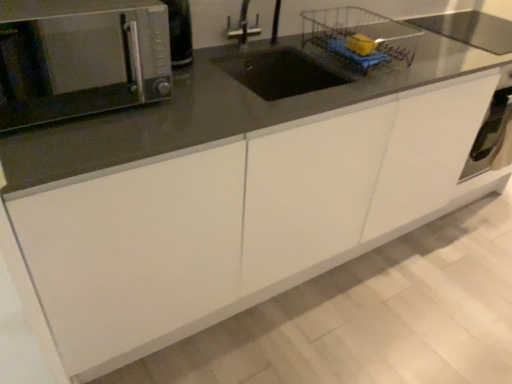
Question: Considering the relative positions of satin silver oven at lower right and satin silver microwave at upper left in the image provided, is satin silver oven at lower right to the right of satin silver microwave at upper left from the viewer's perspective?

Choices:
 (A) yes
 (B) no

Answer: (A)

Question: Can you confirm if satin silver oven at lower right is thinner than satin silver microwave at upper left?

Choices:
 (A) yes
 (B) no

Answer: (A)

Question: Can you confirm if satin silver oven at lower right is positioned to the left of satin silver microwave at upper left?

Choices:
 (A) yes
 (B) no

Answer: (B)

Question: Is the depth of satin silver oven at lower right less than that of satin silver microwave at upper left?

Choices:
 (A) no
 (B) yes

Answer: (A)

Question: Is satin silver oven at lower right facing away from satin silver microwave at upper left?

Choices:
 (A) yes
 (B) no

Answer: (B)

Question: Considering the relative sizes of satin silver oven at lower right and satin silver microwave at upper left in the image provided, is satin silver oven at lower right taller than satin silver microwave at upper left?

Choices:
 (A) yes
 (B) no

Answer: (A)

Question: Considering the relative sizes of wire mesh basket at upper center and satin silver microwave at upper left in the image provided, is wire mesh basket at upper center smaller than satin silver microwave at upper left?

Choices:
 (A) no
 (B) yes

Answer: (B)

Question: Can you confirm if wire mesh basket at upper center is positioned to the left of satin silver microwave at upper left?

Choices:
 (A) no
 (B) yes

Answer: (A)

Question: Would you say wire mesh basket at upper center is outside satin silver microwave at upper left?

Choices:
 (A) no
 (B) yes

Answer: (B)

Question: Is satin silver microwave at upper left located within wire mesh basket at upper center?

Choices:
 (A) yes
 (B) no

Answer: (B)

Question: Is the depth of wire mesh basket at upper center greater than that of satin silver microwave at upper left?

Choices:
 (A) yes
 (B) no

Answer: (A)

Question: Does wire mesh basket at upper center appear on the right side of satin silver microwave at upper left?

Choices:
 (A) yes
 (B) no

Answer: (A)

Question: From a real-world perspective, does wire mesh basket at upper center sit lower than satin silver oven at lower right?

Choices:
 (A) no
 (B) yes

Answer: (A)